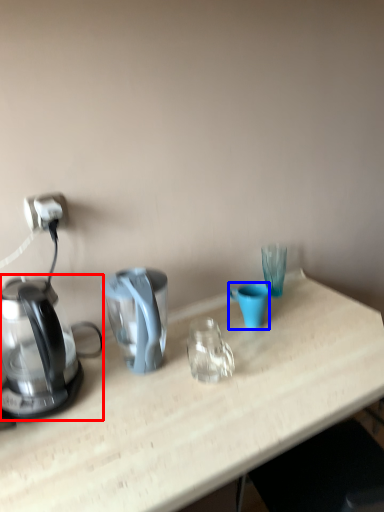
Question: Which of the following is the farthest to the observer, kettle (highlighted by a red box) or coffee cup (highlighted by a blue box)?

Choices:
 (A) kettle
 (B) coffee cup

Answer: (B)